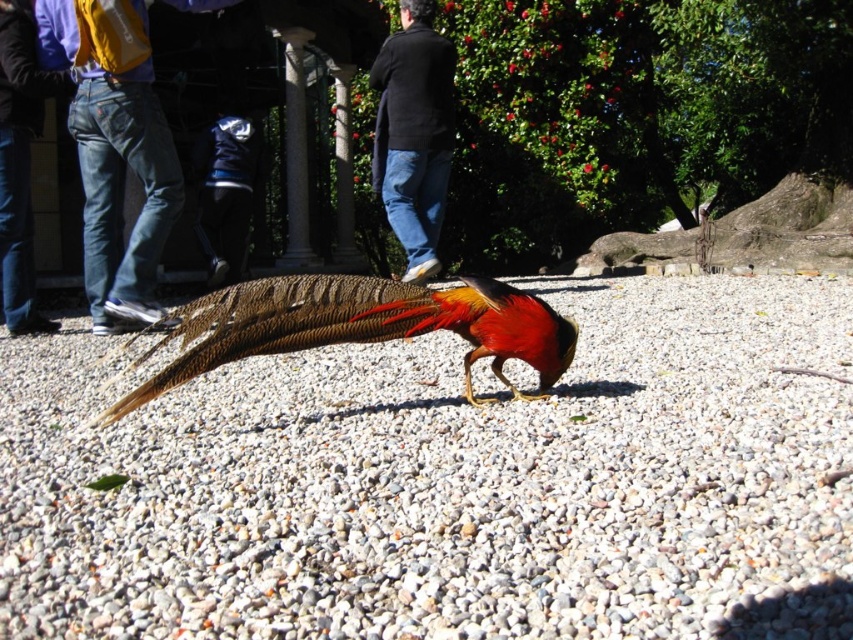
Question: Which of these objects is positioned closest to the gray gravel at center?

Choices:
 (A) jeans at left
 (B) shiny golden bird at center

Answer: (B)

Question: Is gray gravel at center to the right of black matte sweater at center from the viewer's perspective?

Choices:
 (A) yes
 (B) no

Answer: (A)

Question: Which of the following is the closest to the observer?

Choices:
 (A) (172, 490)
 (B) (173, 381)
 (C) (442, 154)

Answer: (A)

Question: Which point is closer to the camera?

Choices:
 (A) (300, 342)
 (B) (407, 28)
 (C) (289, 408)

Answer: (A)

Question: Can you confirm if jeans at left is bigger than black matte sweater at center?

Choices:
 (A) no
 (B) yes

Answer: (B)

Question: Is gray gravel at center above black matte sweater at center?

Choices:
 (A) no
 (B) yes

Answer: (A)